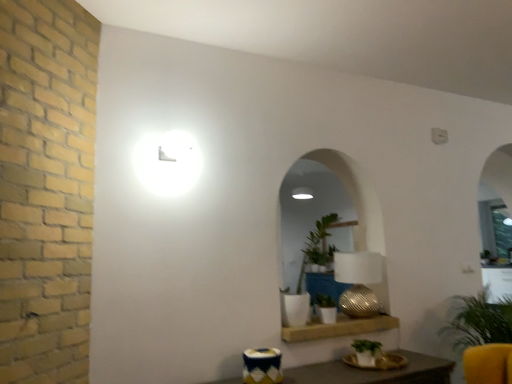
Describe the element at coordinates (325, 308) in the screenshot. I see `green matte plant at center, placed as the 3th houseplant when sorted from right to left` at that location.

Where is `wooden shelf at lower center`? wooden shelf at lower center is located at coordinates (338, 327).

Describe the element at coordinates (358, 282) in the screenshot. I see `textured gold table lamp at center` at that location.

The height and width of the screenshot is (384, 512). What do you see at coordinates (304, 272) in the screenshot?
I see `white ceramic plant at center, the 1th houseplant from the left` at bounding box center [304, 272].

Identify the location of green matte plant at center, which appears as the 2th houseplant when viewed from the left. click(x=325, y=308).

From a real-world perspective, who is located lower, green leafy plant at right, which appears as the first houseplant when viewed from the right, or green matte plant at lower center, which appears as the 3th houseplant when viewed from the left?

green leafy plant at right, which appears as the first houseplant when viewed from the right, from a real-world perspective.

Considering the sizes of green leafy plant at right, positioned as the fourth houseplant in left-to-right order, and green matte plant at lower center, which appears as the 3th houseplant when viewed from the left, in the image, is green leafy plant at right, positioned as the fourth houseplant in left-to-right order, wider or thinner than green matte plant at lower center, which appears as the 3th houseplant when viewed from the left,?

Considering their sizes, green leafy plant at right, positioned as the fourth houseplant in left-to-right order, looks broader than green matte plant at lower center, which appears as the 3th houseplant when viewed from the left.

Which of these two, green leafy plant at right, positioned as the fourth houseplant in left-to-right order, or green matte plant at lower center, which appears as the 3th houseplant when viewed from the left, stands shorter?

green matte plant at lower center, which appears as the 3th houseplant when viewed from the left, is shorter.

Which point is more forward, (501, 307) or (359, 363)?

Positioned in front is point (359, 363).

Considering the sizes of objects green leafy plant at right, positioned as the fourth houseplant in left-to-right order, and white ceramic plant at center, which is the fourth houseplant in right-to-left order, in the image provided, who is bigger, green leafy plant at right, positioned as the fourth houseplant in left-to-right order, or white ceramic plant at center, which is the fourth houseplant in right-to-left order,?

Bigger between the two is green leafy plant at right, positioned as the fourth houseplant in left-to-right order.

Can you tell me how much green leafy plant at right, positioned as the fourth houseplant in left-to-right order, and white ceramic plant at center, the 1th houseplant from the left, differ in facing direction?

1.09 degrees.

Would you say green leafy plant at right, positioned as the fourth houseplant in left-to-right order, contains white ceramic plant at center, the 1th houseplant from the left?

No, white ceramic plant at center, the 1th houseplant from the left, is not a part of green leafy plant at right, positioned as the fourth houseplant in left-to-right order.

In the scene shown: Which is farther, (365,352) or (336,261)?

The point (336,261) is farther.

From the image's perspective, between green matte plant at lower center, the second houseplant from the right, and textured gold table lamp at center, who is located below?

green matte plant at lower center, the second houseplant from the right, from the image's perspective.

Is textured gold table lamp at center at the back of green matte plant at lower center, the second houseplant from the right?

That's not correct — green matte plant at lower center, the second houseplant from the right, is not looking away from textured gold table lamp at center.

Does textured gold table lamp at center have a lesser height compared to green matte plant at center, placed as the 3th houseplant when sorted from right to left?

In fact, textured gold table lamp at center may be taller than green matte plant at center, placed as the 3th houseplant when sorted from right to left.

Does textured gold table lamp at center have a larger size compared to green matte plant at center, which appears as the 2th houseplant when viewed from the left?

Yes.

Is green matte plant at center, which appears as the 2th houseplant when viewed from the left, at the back of textured gold table lamp at center?

Yes, textured gold table lamp at center is positioned with its back facing green matte plant at center, which appears as the 2th houseplant when viewed from the left.

Locate an element on the screen. the 2nd houseplant positioned above the wooden shelf at lower center (from the image's perspective) is located at coordinates 304,272.

From a real-world perspective, which object rests below the other?

wooden shelf at lower center, from a real-world perspective.

Measure the distance between white ceramic plant at center, the 1th houseplant from the left, and wooden shelf at lower center.

white ceramic plant at center, the 1th houseplant from the left, is 11.75 inches from wooden shelf at lower center.

Is white ceramic plant at center, the 1th houseplant from the left, to the left or to the right of wooden shelf at lower center in the image?

In the image, white ceramic plant at center, the 1th houseplant from the left, appears on the left side of wooden shelf at lower center.

Is white ceramic plant at center, the 1th houseplant from the left, far away from green matte plant at lower center, which appears as the 3th houseplant when viewed from the left?

No, white ceramic plant at center, the 1th houseplant from the left, is not far away from green matte plant at lower center, which appears as the 3th houseplant when viewed from the left.

Measure the distance between white ceramic plant at center, the 1th houseplant from the left, and green matte plant at lower center, which appears as the 3th houseplant when viewed from the left.

A distance of 20.93 inches exists between white ceramic plant at center, the 1th houseplant from the left, and green matte plant at lower center, which appears as the 3th houseplant when viewed from the left.

From the image's perspective, does white ceramic plant at center, which is the fourth houseplant in right-to-left order, appear higher than green matte plant at lower center, which appears as the 3th houseplant when viewed from the left?

Indeed, from the image's perspective, white ceramic plant at center, which is the fourth houseplant in right-to-left order, is shown above green matte plant at lower center, which appears as the 3th houseplant when viewed from the left.

From a real-world perspective, is white ceramic plant at center, the 1th houseplant from the left, on green matte plant at lower center, the second houseplant from the right?

Indeed, from a real-world perspective, white ceramic plant at center, the 1th houseplant from the left, stands above green matte plant at lower center, the second houseplant from the right.

How different are the orientations of textured gold table lamp at center and green matte plant at lower center, which appears as the 3th houseplant when viewed from the left, in degrees?

88.1 degrees.

Do you think textured gold table lamp at center is within green matte plant at lower center, which appears as the 3th houseplant when viewed from the left, or outside of it?

textured gold table lamp at center is outside green matte plant at lower center, which appears as the 3th houseplant when viewed from the left.

From the image's perspective, would you say textured gold table lamp at center is shown under green matte plant at lower center, which appears as the 3th houseplant when viewed from the left?

Actually, textured gold table lamp at center appears above green matte plant at lower center, which appears as the 3th houseplant when viewed from the left, in the image.

Considering their positions, is textured gold table lamp at center located in front of or behind green matte plant at lower center, the second houseplant from the right?

textured gold table lamp at center is positioned farther from the viewer than green matte plant at lower center, the second houseplant from the right.

This screenshot has height=384, width=512. In the image, there is a green matte plant at lower center, which appears as the 3th houseplant when viewed from the left. Find the location of `houseplant below it (from the image's perspective)`. houseplant below it (from the image's perspective) is located at coordinates (478, 321).

The image size is (512, 384). I want to click on houseplant that is the 2nd object located in front of the white ceramic plant at center, the 1th houseplant from the left, so click(x=478, y=321).

Estimate the real-world distances between objects in this image. Which object is further from green matte plant at lower center, which appears as the 3th houseplant when viewed from the left, green matte plant at center, which appears as the 2th houseplant when viewed from the left, or textured gold table lamp at center?

Among the two, textured gold table lamp at center is located further to green matte plant at lower center, which appears as the 3th houseplant when viewed from the left.

Based on their spatial positions, is white ceramic plant at center, the 1th houseplant from the left, or green leafy plant at right, positioned as the fourth houseplant in left-to-right order, further from green matte plant at center, placed as the 3th houseplant when sorted from right to left?

Based on the image, green leafy plant at right, positioned as the fourth houseplant in left-to-right order, appears to be further to green matte plant at center, placed as the 3th houseplant when sorted from right to left.

From the image, which object appears to be farther from textured gold table lamp at center, green matte plant at center, which appears as the 2th houseplant when viewed from the left, or white ceramic plant at center, the 1th houseplant from the left?

white ceramic plant at center, the 1th houseplant from the left, is positioned further to the anchor textured gold table lamp at center.

From the image, which object appears to be farther from green leafy plant at right, positioned as the fourth houseplant in left-to-right order, textured gold table lamp at center or white ceramic plant at center, the 1th houseplant from the left?

The object further to green leafy plant at right, positioned as the fourth houseplant in left-to-right order, is white ceramic plant at center, the 1th houseplant from the left.

Looking at the image, which one is located further to green matte plant at center, placed as the 3th houseplant when sorted from right to left, white ceramic plant at center, the 1th houseplant from the left, or textured gold table lamp at center?

Among the two, white ceramic plant at center, the 1th houseplant from the left, is located further to green matte plant at center, placed as the 3th houseplant when sorted from right to left.

From the image, which object appears to be farther from textured gold table lamp at center, wooden shelf at lower center or white ceramic plant at center, which is the fourth houseplant in right-to-left order?

The object further to textured gold table lamp at center is white ceramic plant at center, which is the fourth houseplant in right-to-left order.

Considering their positions, is green matte plant at lower center, the second houseplant from the right, positioned closer to wooden shelf at lower center than green matte plant at center, which appears as the 2th houseplant when viewed from the left?

green matte plant at center, which appears as the 2th houseplant when viewed from the left, is positioned closer to the anchor wooden shelf at lower center.

From the image, which object appears to be farther from green matte plant at center, placed as the 3th houseplant when sorted from right to left, green leafy plant at right, which appears as the first houseplant when viewed from the right, or green matte plant at lower center, which appears as the 3th houseplant when viewed from the left?

green leafy plant at right, which appears as the first houseplant when viewed from the right, lies further to green matte plant at center, placed as the 3th houseplant when sorted from right to left, than the other object.

This screenshot has width=512, height=384. I want to click on shelf located between white ceramic plant at center, the 1th houseplant from the left, and green leafy plant at right, positioned as the fourth houseplant in left-to-right order, in the left-right direction, so click(x=338, y=327).

The height and width of the screenshot is (384, 512). In order to click on shelf between white ceramic plant at center, the 1th houseplant from the left, and green matte plant at lower center, the second houseplant from the right, in the up-down direction in this screenshot , I will do `click(338, 327)`.

This screenshot has width=512, height=384. Identify the location of houseplant that lies between white ceramic plant at center, which is the fourth houseplant in right-to-left order, and wooden shelf at lower center from top to bottom. click(325, 308).

This screenshot has height=384, width=512. I want to click on houseplant situated between green matte plant at center, which appears as the 2th houseplant when viewed from the left, and green leafy plant at right, which appears as the first houseplant when viewed from the right, from left to right, so click(x=366, y=352).